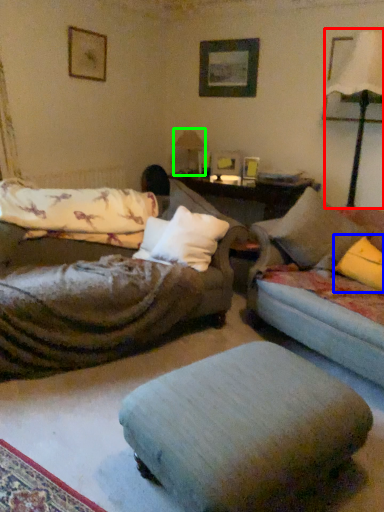
Question: Considering the real-world distances, which object is closest to table lamp (highlighted by a red box)? pillow (highlighted by a blue box) or table lamp (highlighted by a green box).

Choices:
 (A) pillow
 (B) table lamp

Answer: (A)